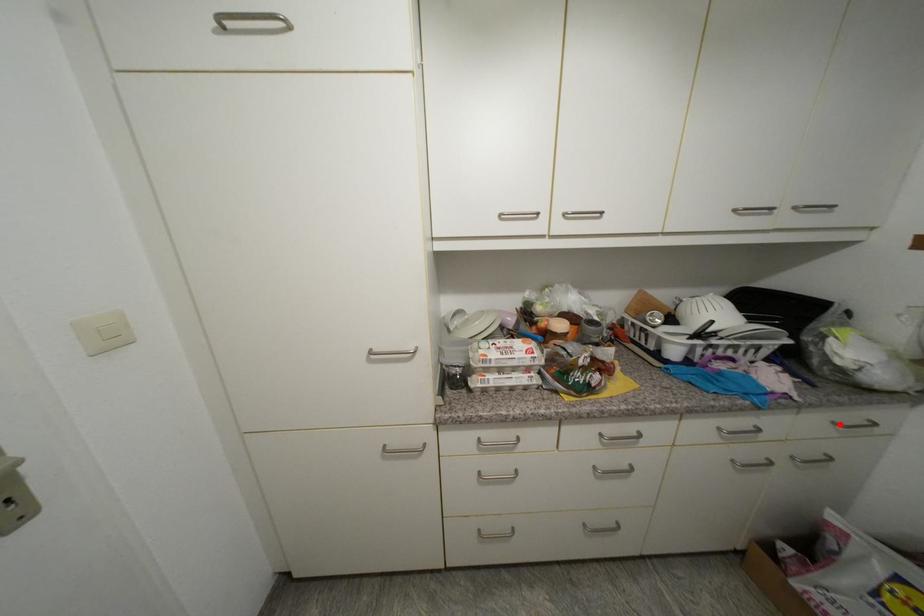
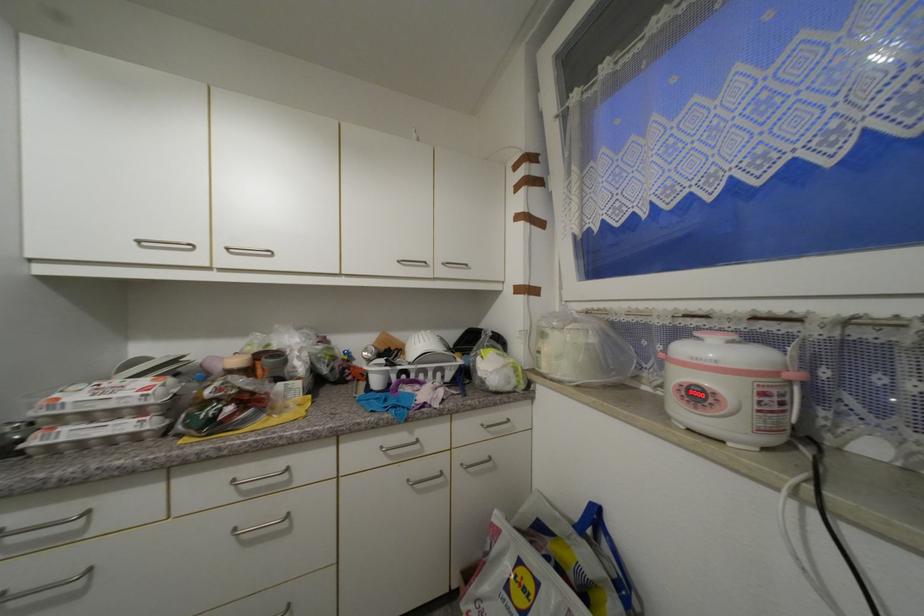
Question: I am providing you with two images of the same scene from different viewpoints. Image1 has a red point marked. In image2, the corresponding 3D location appears at what relative position? Reply with the corresponding letter.

Choices:
 (A) Closer
 (B) Farther

Answer: (B)